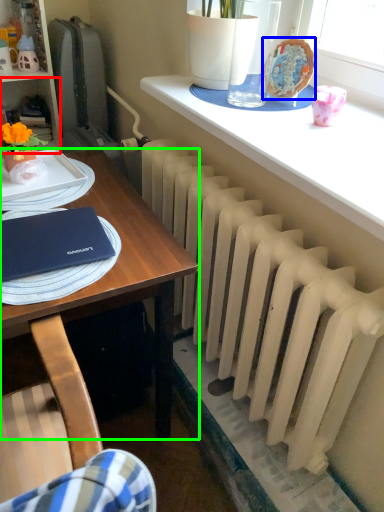
Question: Based on their relative distances, which object is farther from shelf (highlighted by a red box)? Choose from floral arrangement (highlighted by a blue box) and desk (highlighted by a green box).

Choices:
 (A) floral arrangement
 (B) desk

Answer: (A)